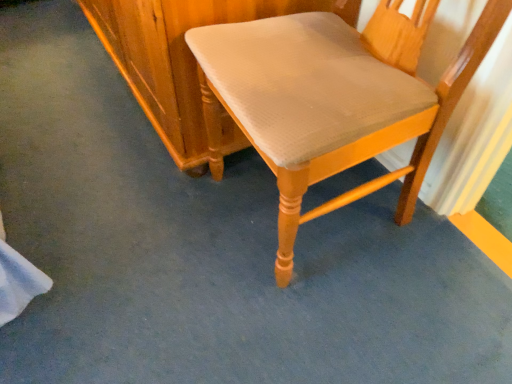
Find the location of a particular element. Image resolution: width=512 pixels, height=384 pixels. light brown wood chair at center is located at coordinates (332, 100).

The image size is (512, 384). What do you see at coordinates (332, 100) in the screenshot? I see `light brown wood chair at center` at bounding box center [332, 100].

Where is `light brown wood chair at center`? The width and height of the screenshot is (512, 384). light brown wood chair at center is located at coordinates (332, 100).